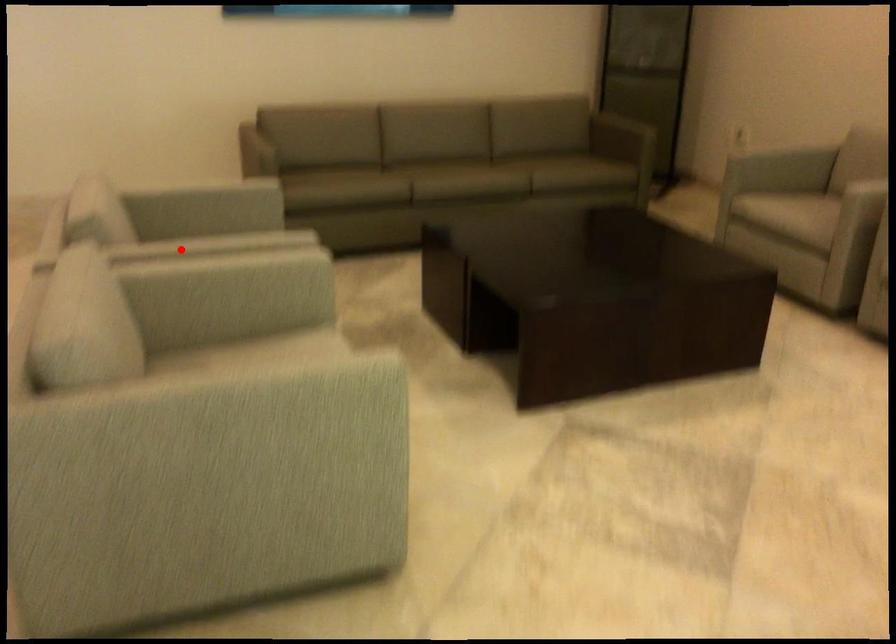
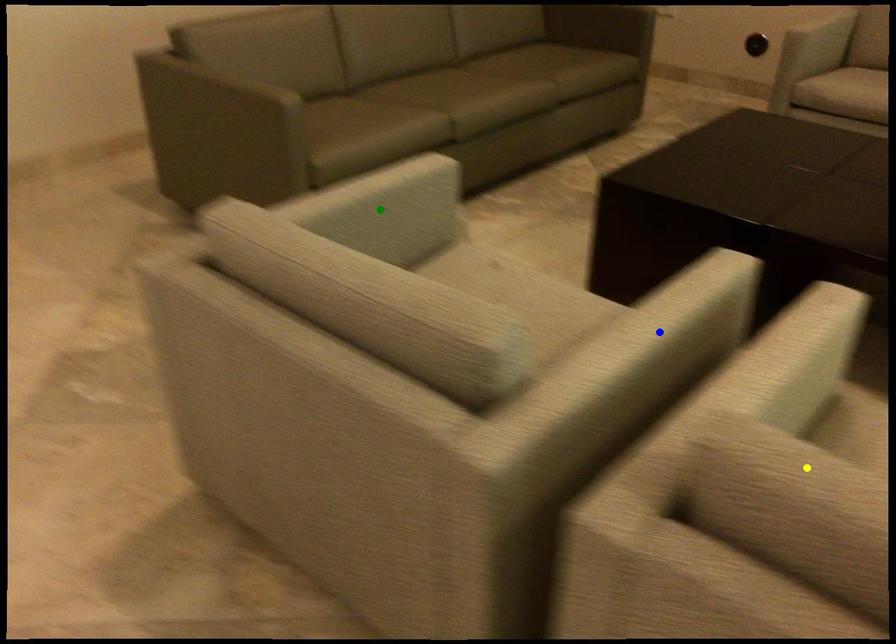
Question: I am providing you with two images of the same scene from different viewpoints. A red point is marked on the first image. You are given multiple points on the second image. Can you choose the point in image 2 that corresponds to the point in image 1?

Choices:
 (A) blue point
 (B) yellow point
 (C) green point

Answer: (A)